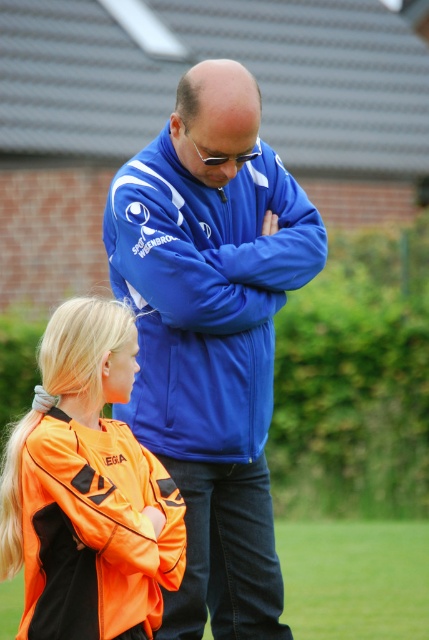
Does orange fabric jacket at lower left have a greater height compared to green grass at lower center?

Yes, orange fabric jacket at lower left is taller than green grass at lower center.

Is orange fabric jacket at lower left bigger than green grass at lower center?

Yes.

Is point (90, 577) less distant than point (390, 554)?

Yes, it is in front of point (390, 554).

Identify the location of orange fabric jacket at lower left. This screenshot has height=640, width=429. (85, 493).

Is blue softshell jacket at center positioned at the back of orange fabric jacket at lower left?

Yes, it is.

The image size is (429, 640). Describe the element at coordinates (211, 333) in the screenshot. I see `blue softshell jacket at center` at that location.

Does point (151, 404) lie in front of point (41, 481)?

No, it is not.

Identify the location of blue softshell jacket at center. The image size is (429, 640). (211, 333).

Does blue softshell jacket at center appear over green grass at lower center?

Yes, blue softshell jacket at center is above green grass at lower center.

Who is shorter, blue softshell jacket at center or green grass at lower center?

green grass at lower center

Locate an element on the screen. blue softshell jacket at center is located at coordinates pos(211,333).